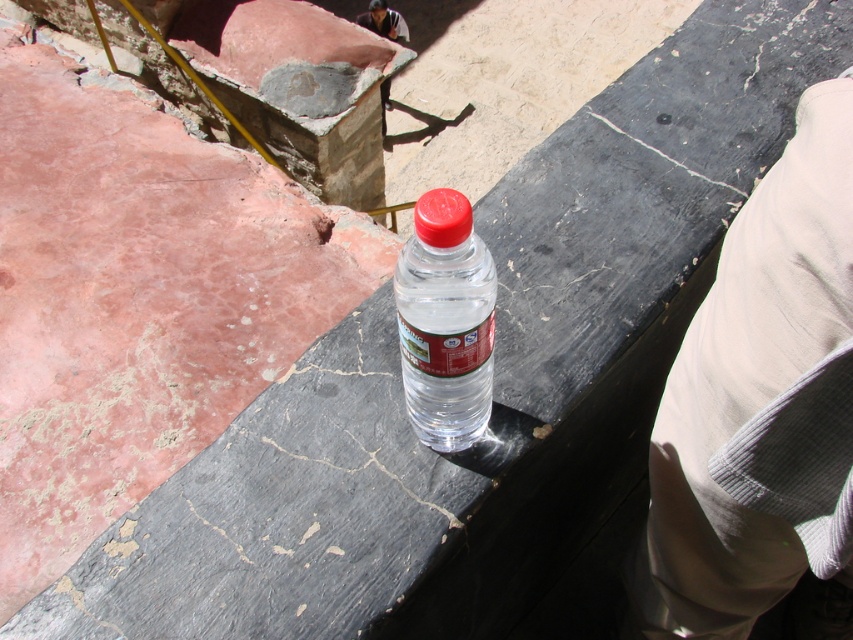
You are a photographer trying to capture both the beige corduroy pants at lower right and the transparent plastic bottle at center in a single frame. Considering their sizes, which object will occupy more space in your photo?

The beige corduroy pants at lower right is larger in size than the transparent plastic bottle at center, so it will occupy more space in the photo.

Consider the image. You are standing at the edge of the stone ledge and need to place both the beige corduroy pants at lower right and the transparent plastic bottle at center on the ledge. Which object requires more horizontal space to fit properly?

The beige corduroy pants at lower right requires more horizontal space because its width surpasses that of the transparent plastic bottle at center.